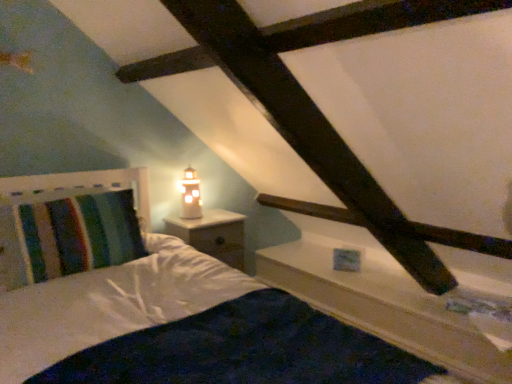
Where is `white wood ledge at upper right`? white wood ledge at upper right is located at coordinates (383, 305).

What do you see at coordinates (212, 234) in the screenshot? I see `white wood nightstand at center` at bounding box center [212, 234].

Describe the element at coordinates (75, 234) in the screenshot. I see `striped fabric pillow at left` at that location.

You are a GUI agent. You are given a task and a screenshot of the screen. Output one action in this format:
    pyautogui.click(x=<x>, y=<y>)
    Task: Click on the white wood ledge at upper right
    
    Given the screenshot: What is the action you would take?
    pos(383,305)

This screenshot has height=384, width=512. In order to click on ledge in front of the matte glass table lamp at upper center in this screenshot , I will do `click(383, 305)`.

Can you confirm if matte glass table lamp at upper center is wider than white wood ledge at upper right?

No.

How different are the orientations of matte glass table lamp at upper center and white wood ledge at upper right in degrees?

92.7 degrees.

Would you say matte glass table lamp at upper center is outside white wood ledge at upper right?

Yes, matte glass table lamp at upper center is located beyond the bounds of white wood ledge at upper right.

Are white wood ledge at upper right and matte glass table lamp at upper center beside each other?

No, white wood ledge at upper right is not next to matte glass table lamp at upper center.

Which object is positioned more to the left, white wood ledge at upper right or matte glass table lamp at upper center?

Positioned to the left is matte glass table lamp at upper center.

Is white wood ledge at upper right oriented towards matte glass table lamp at upper center?

No, white wood ledge at upper right is not oriented towards matte glass table lamp at upper center.

Does matte glass table lamp at upper center have a lesser height compared to striped fabric pillow at left?

In fact, matte glass table lamp at upper center may be taller than striped fabric pillow at left.

Is matte glass table lamp at upper center positioned beyond the bounds of striped fabric pillow at left?

Yes.

Is point (194, 215) positioned in front of point (30, 278)?

No, (194, 215) is further to viewer.

Who is smaller, matte glass table lamp at upper center or striped fabric pillow at left?

matte glass table lamp at upper center is smaller.

How different are the orientations of striped fabric pillow at left and white wood nightstand at center in degrees?

92.8 degrees separate the facing orientations of striped fabric pillow at left and white wood nightstand at center.

Which object is positioned more to the right, striped fabric pillow at left or white wood nightstand at center?

Positioned to the right is white wood nightstand at center.

From the image's perspective, which one is positioned higher, striped fabric pillow at left or white wood nightstand at center?

striped fabric pillow at left.

Considering the positions of objects striped fabric pillow at left and white wood nightstand at center in the image provided, who is behind, striped fabric pillow at left or white wood nightstand at center?

white wood nightstand at center.

Based on the photo, how many degrees apart are the facing directions of striped fabric pillow at left and white wood ledge at upper right?

3.93 degrees separate the facing orientations of striped fabric pillow at left and white wood ledge at upper right.

Is striped fabric pillow at left further to camera compared to white wood ledge at upper right?

No, it is in front of white wood ledge at upper right.

Is striped fabric pillow at left touching white wood ledge at upper right?

striped fabric pillow at left and white wood ledge at upper right are not in contact.

Measure the distance from white wood ledge at upper right to white wood nightstand at center.

white wood ledge at upper right is 31.96 inches away from white wood nightstand at center.

Considering the sizes of white wood ledge at upper right and white wood nightstand at center in the image, is white wood ledge at upper right wider or thinner than white wood nightstand at center?

Clearly, white wood ledge at upper right has more width compared to white wood nightstand at center.

I want to click on nightstand behind the white wood ledge at upper right, so click(212, 234).

What's the angular difference between white wood ledge at upper right and white wood nightstand at center's facing directions?

88.9 degrees.

Is white wood ledge at upper right thinner than striped fabric pillow at left?

Yes, white wood ledge at upper right is thinner than striped fabric pillow at left.

The height and width of the screenshot is (384, 512). In order to click on ledge below the striped fabric pillow at left (from the image's perspective) in this screenshot , I will do `click(383, 305)`.

Does white wood ledge at upper right appear on the right side of striped fabric pillow at left?

Yes.

What's the angular difference between white wood ledge at upper right and striped fabric pillow at left's facing directions?

white wood ledge at upper right and striped fabric pillow at left are facing 3.93 degrees away from each other.

At what (x,y) coordinates should I click in order to perform the action: click on ledge beneath the matte glass table lamp at upper center (from a real-world perspective). Please return your answer as a coordinate pair (x, y). Looking at the image, I should click on (383, 305).

This screenshot has width=512, height=384. I want to click on ledge on the right of the matte glass table lamp at upper center, so click(383, 305).

Considering their positions, is white wood ledge at upper right positioned further to matte glass table lamp at upper center than white wood nightstand at center?

white wood ledge at upper right.

Estimate the real-world distances between objects in this image. Which object is further from striped fabric pillow at left, matte glass table lamp at upper center or white wood ledge at upper right?

white wood ledge at upper right.

Considering their positions, is matte glass table lamp at upper center positioned further to white wood ledge at upper right than white wood nightstand at center?

matte glass table lamp at upper center is further to white wood ledge at upper right.

When comparing their distances from striped fabric pillow at left, does white wood nightstand at center or matte glass table lamp at upper center seem closer?

white wood nightstand at center is positioned closer to the anchor striped fabric pillow at left.

Based on their spatial positions, is white wood nightstand at center or matte glass table lamp at upper center closer to white wood ledge at upper right?

The object closer to white wood ledge at upper right is white wood nightstand at center.

Which object lies further to the anchor point matte glass table lamp at upper center, white wood nightstand at center or striped fabric pillow at left?

Based on the image, striped fabric pillow at left appears to be further to matte glass table lamp at upper center.

Estimate the real-world distances between objects in this image. Which object is further from white wood nightstand at center, matte glass table lamp at upper center or white wood ledge at upper right?

white wood ledge at upper right.

Based on their spatial positions, is striped fabric pillow at left or matte glass table lamp at upper center closer to white wood nightstand at center?

matte glass table lamp at upper center.

This screenshot has height=384, width=512. In order to click on nightstand situated between matte glass table lamp at upper center and white wood ledge at upper right from left to right in this screenshot , I will do `click(212, 234)`.

The image size is (512, 384). What are the coordinates of `table lamp located between striped fabric pillow at left and white wood ledge at upper right in the left-right direction` in the screenshot? It's located at (190, 195).

What are the coordinates of `nightstand between striped fabric pillow at left and matte glass table lamp at upper center in the front-back direction` in the screenshot? It's located at (212, 234).

The height and width of the screenshot is (384, 512). What are the coordinates of `nightstand situated between striped fabric pillow at left and white wood ledge at upper right from left to right` in the screenshot? It's located at (212, 234).